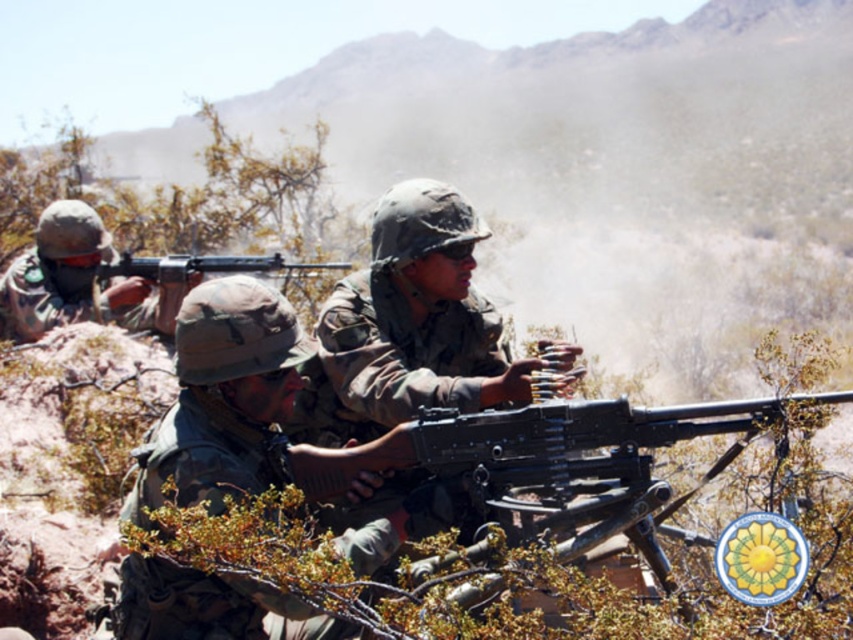
Question: Is camouflage fabric uniform at center wider than matte green helmet at left?

Choices:
 (A) no
 (B) yes

Answer: (A)

Question: Does matte green helmet at left appear on the right side of matte black machine gun at center?

Choices:
 (A) no
 (B) yes

Answer: (A)

Question: Among these objects, which one is farthest from the camera?

Choices:
 (A) metallic black machine gun at center
 (B) matte black machine gun at center
 (C) camouflage fabric uniform at center

Answer: (B)

Question: Which object is farther from the camera taking this photo?

Choices:
 (A) matte green helmet at left
 (B) matte black machine gun at center
 (C) camouflage fabric uniform at center
 (D) metallic black machine gun at center

Answer: (B)

Question: Which of the following is the closest to the observer?

Choices:
 (A) (363, 460)
 (B) (170, 256)
 (C) (183, 285)

Answer: (A)

Question: Is camouflage fabric uniform at center to the left of metallic black machine gun at center from the viewer's perspective?

Choices:
 (A) no
 (B) yes

Answer: (B)